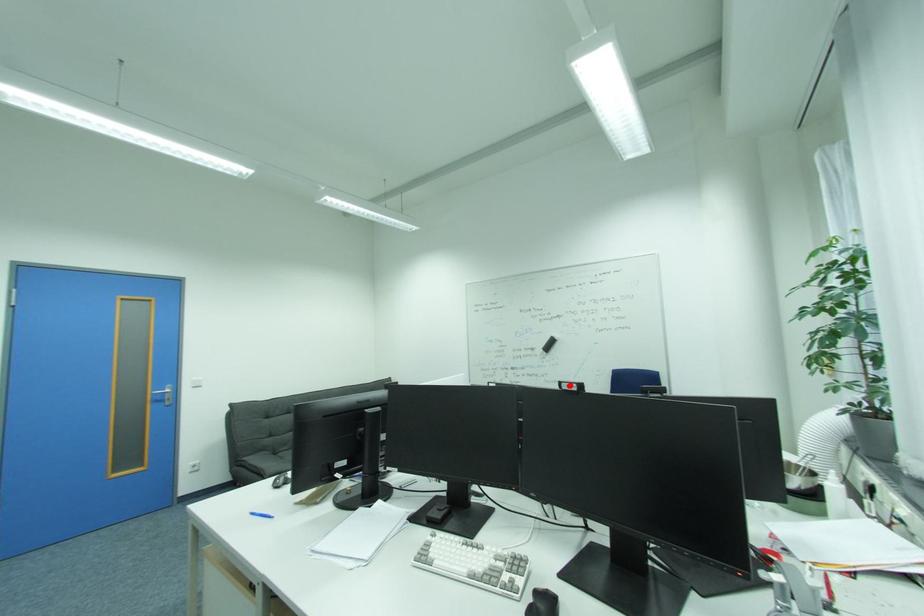
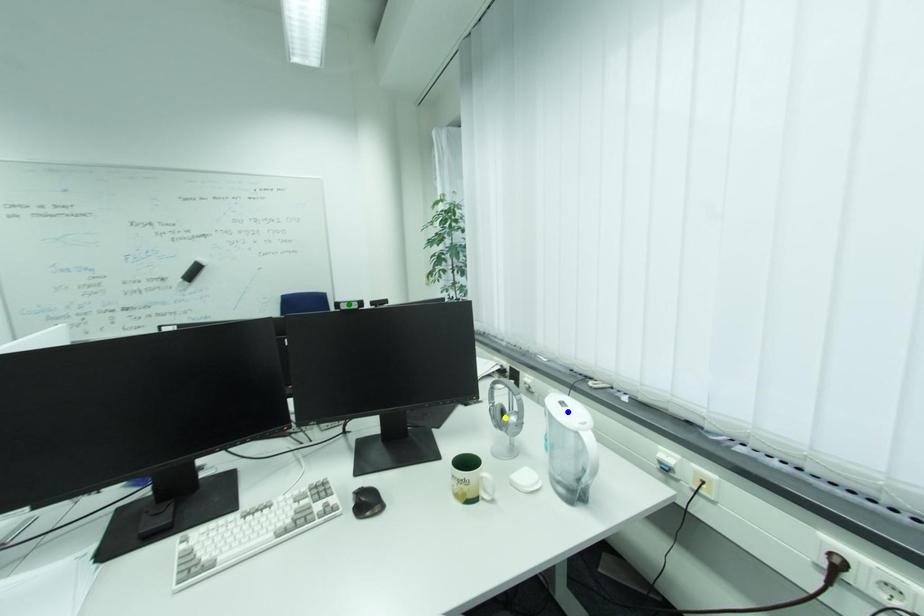
Question: I am providing you with two images of the same scene from different viewpoints. A red point is marked on the first image. You are given multiple points on the second image. Can you choose the point in image 2 that corresponds to the point in image 1?

Choices:
 (A) yellow point
 (B) blue point
 (C) green point

Answer: (C)